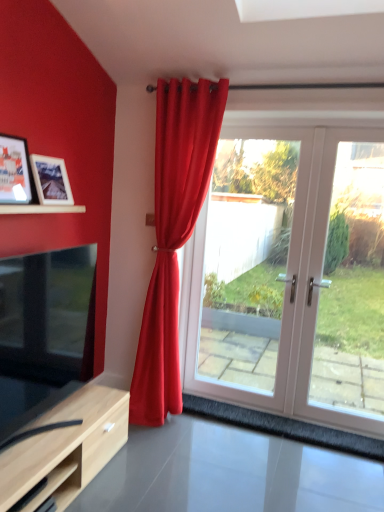
What are the coordinates of `vacant area that lies to the right of matte red curtain at center` in the screenshot? It's located at (229, 435).